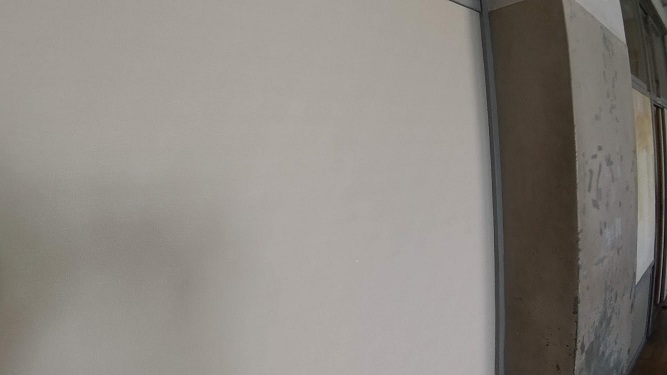
Identify the location of water stain. (645, 146).